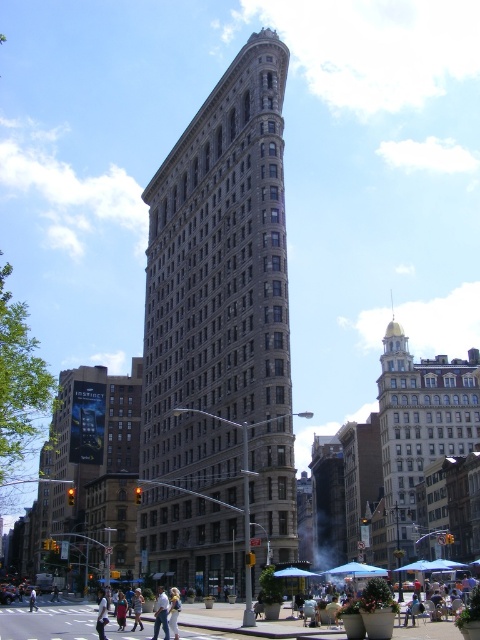
Is point (49, 451) less distant than point (172, 634)?

That is False.

Can you confirm if brown stone billboard at left is bigger than light blue denim jeans at center?

Indeed, brown stone billboard at left has a larger size compared to light blue denim jeans at center.

Is point (131, 394) positioned in front of point (171, 596)?

That is False.

At what (x,y) coordinates should I click in order to perform the action: click on brown stone billboard at left. Please return your answer as a coordinate pair (x, y). The image size is (480, 640). Looking at the image, I should click on (91, 472).

Between white cotton shirt at lower center and green fabric shirt at center, which one has more height?

white cotton shirt at lower center

Can you confirm if white cotton shirt at lower center is shorter than green fabric shirt at center?

No.

Which is behind, point (101, 604) or point (122, 602)?

Point (122, 602)

Identify the location of white cotton shirt at lower center. This screenshot has width=480, height=640. [101, 614].

Which is more to the right, light blue denim jeans at center or white cotton shirt at lower center?

light blue denim jeans at center is more to the right.

Between light blue denim jeans at center and white cotton shirt at lower center, which one is positioned lower?

Positioned lower is white cotton shirt at lower center.

Which is behind, point (171, 592) or point (101, 592)?

Positioned behind is point (101, 592).

In order to click on light blue denim jeans at center in this screenshot , I will do `click(173, 611)`.